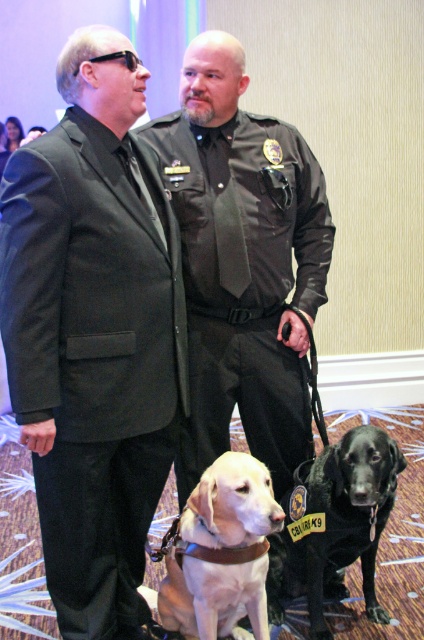
Does black smooth suit at left have a larger size compared to black matte dog at center?

Yes, black smooth suit at left is bigger than black matte dog at center.

Between black smooth suit at left and black matte dog at center, which one is positioned higher?

Positioned higher is black smooth suit at left.

Locate an element on the screen. Image resolution: width=424 pixels, height=640 pixels. black smooth suit at left is located at coordinates (92, 356).

Looking at this image, between black smooth suit at left and light brown fur at center, which one is positioned lower?

light brown fur at center

Can you confirm if black smooth suit at left is thinner than light brown fur at center?

No, black smooth suit at left is not thinner than light brown fur at center.

This screenshot has height=640, width=424. Describe the element at coordinates (92, 356) in the screenshot. I see `black smooth suit at left` at that location.

Identify the location of black smooth suit at left. (92, 356).

Which of these two, light brown fur at center or black matte dog at center, stands shorter?

light brown fur at center

Measure the distance between point (225, 561) and camera.

Point (225, 561) is 1.60 meters from camera.

Locate an element on the screen. light brown fur at center is located at coordinates (222, 552).